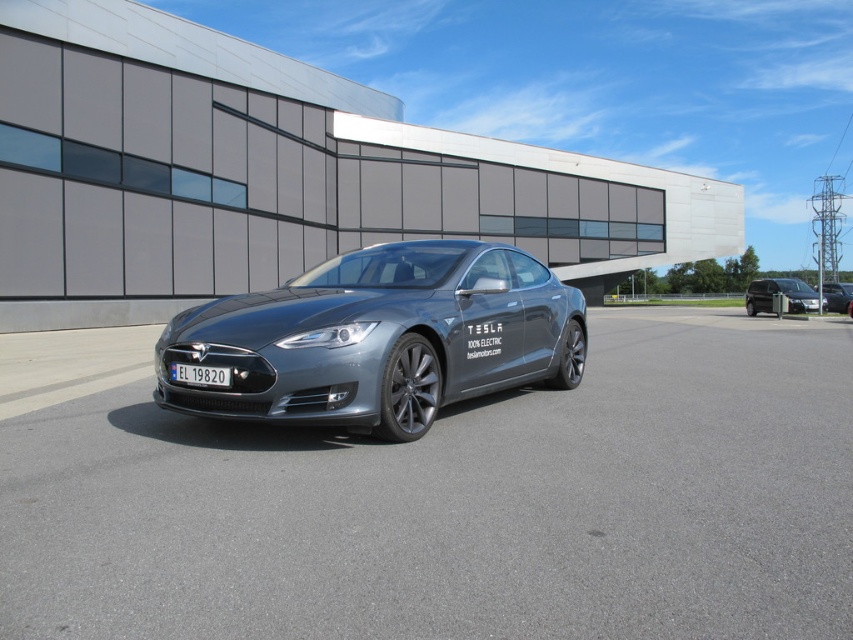
Question: Does red plastic license plate at center appear on the right side of metallic silver sedan at center?

Choices:
 (A) yes
 (B) no

Answer: (B)

Question: Which is farther from the sleek metallic car at center?

Choices:
 (A) metallic silver sedan at center
 (B) metallic silver van at right
 (C) red plastic license plate at center

Answer: (A)

Question: Which point is closer to the camera?

Choices:
 (A) metallic silver sedan at center
 (B) metallic silver van at right

Answer: (B)

Question: Is sleek metallic car at center to the right of metallic silver sedan at center from the viewer's perspective?

Choices:
 (A) no
 (B) yes

Answer: (A)

Question: Which of the following is the closest to the observer?

Choices:
 (A) metallic silver sedan at center
 (B) red plastic license plate at center

Answer: (B)

Question: Can you confirm if metallic silver van at right is wider than red plastic license plate at center?

Choices:
 (A) yes
 (B) no

Answer: (A)